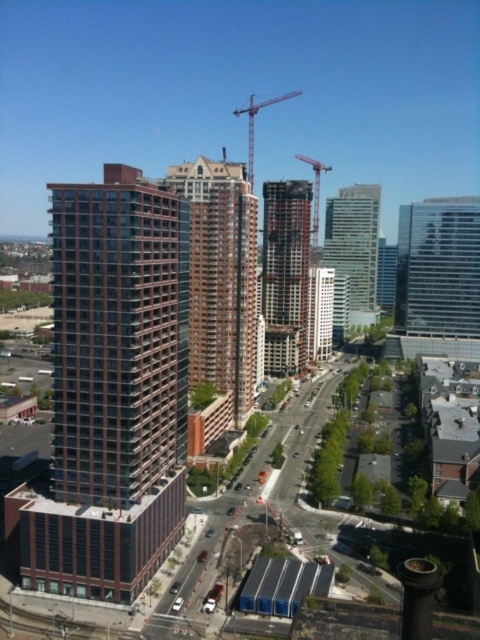
Question: Which of the following is the closest to the observer?

Choices:
 (A) (252, 369)
 (B) (368, 256)

Answer: (A)

Question: Can you confirm if dark brown concrete building at center is thinner than metallic construction crane at center?

Choices:
 (A) no
 (B) yes

Answer: (B)

Question: Can you confirm if brown glassy building at center is positioned to the right of matte glass building at center?

Choices:
 (A) no
 (B) yes

Answer: (A)

Question: Which object appears farthest from the camera in this image?

Choices:
 (A) glassy reflective skyscraper at center
 (B) brown glassy building at center
 (C) dark glass building at center
 (D) metallic gray crane at upper center

Answer: (A)

Question: Is dark glass building at center further to the viewer compared to metallic gray crane at upper center?

Choices:
 (A) no
 (B) yes

Answer: (A)

Question: Based on their relative distances, which object is nearer to the matte glass building at center?

Choices:
 (A) brown glassy building at center
 (B) transparent glass skyscraper at right
 (C) glassy reflective skyscraper at center
 (D) dark glass building at center

Answer: (B)